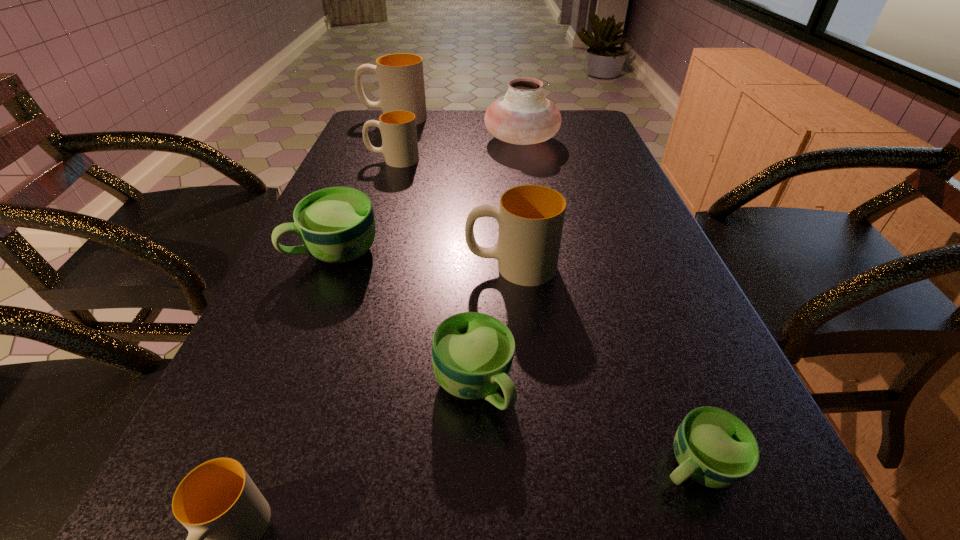
Locate an element on the screen. This screenshot has height=540, width=960. cup present at the far edge is located at coordinates (401, 79).

This screenshot has height=540, width=960. I want to click on pottery present at the far edge, so click(523, 116).

You are a GUI agent. You are given a task and a screenshot of the screen. Output one action in this format:
    pyautogui.click(x=<x>, y=<y>)
    Task: Click on the pottery that is at the right edge
    Image resolution: width=960 pixels, height=540 pixels.
    Given the screenshot: What is the action you would take?
    pyautogui.click(x=523, y=116)

I want to click on cup present at the right edge, so click(715, 448).

At what (x,y) coordinates should I click in order to perform the action: click on object at the far left corner. Please return your answer as a coordinate pair (x, y). Looking at the image, I should click on (401, 79).

Locate an element on the screen. object that is at the far right corner is located at coordinates (523, 116).

In the image, there is a desktop. Identify the location of blank space at the far edge. The width and height of the screenshot is (960, 540). (454, 114).

I want to click on free space at the left edge of the desktop, so [x=314, y=366].

The image size is (960, 540). In order to click on free location at the right edge in this screenshot , I will do `click(577, 144)`.

I want to click on vacant position at the far left corner of the desktop, so click(372, 110).